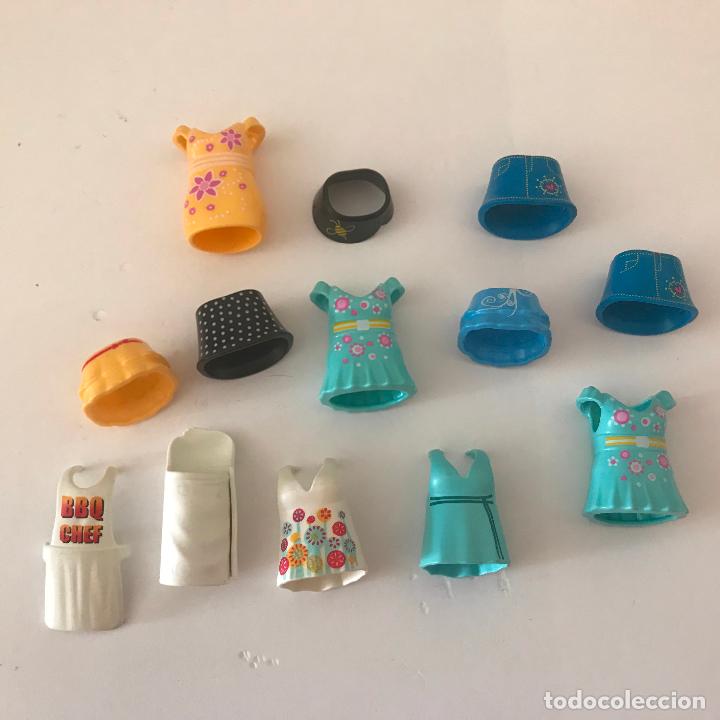
This screenshot has width=720, height=720. In order to click on bottom row of toy doll clothing in this screenshot , I will do `click(91, 570)`, `click(193, 531)`, `click(328, 544)`, `click(456, 534)`, `click(611, 469)`.